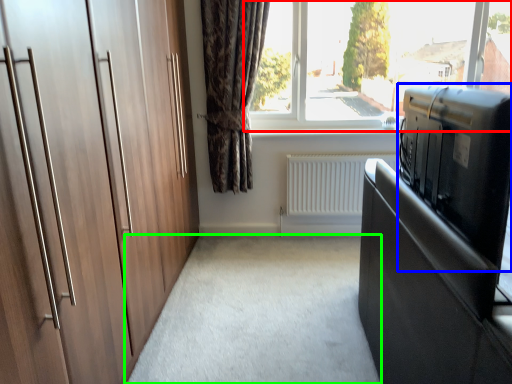
Question: Which object is positioned farthest from window (highlighted by a red box)? Select from appliance (highlighted by a blue box) and plain (highlighted by a green box).

Choices:
 (A) appliance
 (B) plain

Answer: (A)